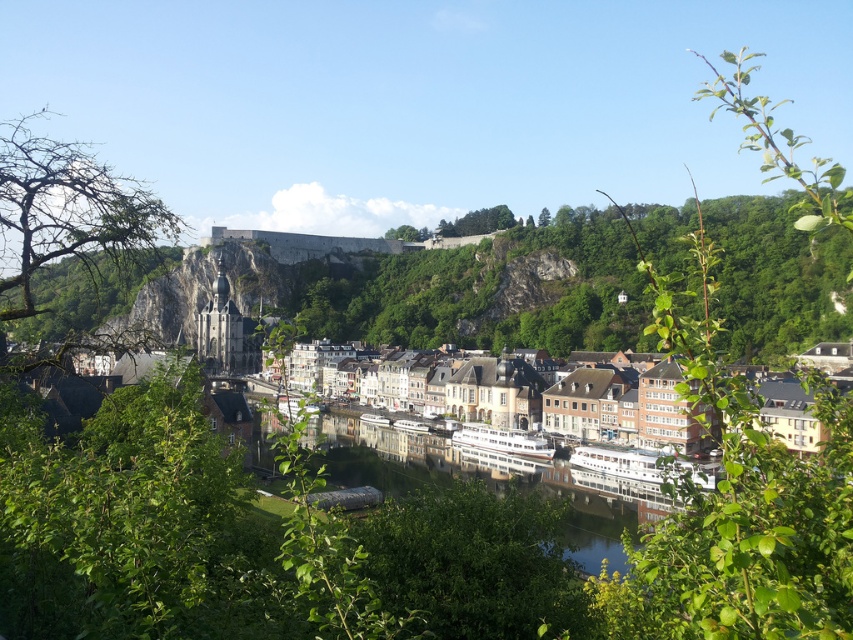
Does green leafy branch at upper right have a larger size compared to white glossy waterway at center?

Yes.

The image size is (853, 640). What do you see at coordinates (740, 506) in the screenshot?
I see `green leafy branch at upper right` at bounding box center [740, 506].

Between point (775, 148) and point (509, 472), which one is positioned behind?

The point (509, 472) is more distant.

Locate an element on the screen. This screenshot has width=853, height=640. green leafy branch at upper right is located at coordinates (740, 506).

Who is shorter, green leafy tree at left or white brick buildings at center?

white brick buildings at center

Does point (7, 282) come farther from viewer compared to point (640, 436)?

No, (7, 282) is in front of (640, 436).

Where is `green leafy tree at left`? The image size is (853, 640). green leafy tree at left is located at coordinates (70, 230).

Does green leafy tree at left appear over white glossy waterway at center?

Correct, green leafy tree at left is located above white glossy waterway at center.

How far apart are green leafy tree at left and white glossy waterway at center?

The distance of green leafy tree at left from white glossy waterway at center is 77.97 meters.

Describe the element at coordinates (70, 230) in the screenshot. I see `green leafy tree at left` at that location.

Locate an element on the screen. This screenshot has width=853, height=640. green leafy tree at left is located at coordinates [70, 230].